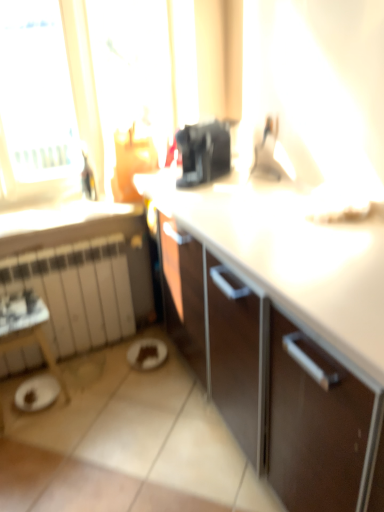
Question: Does brown matte plate at lower center turn towards white matte radiator at lower left?

Choices:
 (A) no
 (B) yes

Answer: (A)

Question: Does brown matte plate at lower center have a lesser width compared to white matte radiator at lower left?

Choices:
 (A) yes
 (B) no

Answer: (B)

Question: Is brown matte plate at lower center turned away from white matte radiator at lower left?

Choices:
 (A) no
 (B) yes

Answer: (B)

Question: Can you confirm if brown matte plate at lower center is bigger than white matte radiator at lower left?

Choices:
 (A) no
 (B) yes

Answer: (A)

Question: From a real-world perspective, is brown matte plate at lower center beneath white matte radiator at lower left?

Choices:
 (A) yes
 (B) no

Answer: (A)

Question: Is brown matte plate at lower center not within white matte radiator at lower left?

Choices:
 (A) no
 (B) yes

Answer: (B)

Question: From the image's perspective, is white matte radiator at lower left on top of brown matte plate at lower center?

Choices:
 (A) no
 (B) yes

Answer: (B)

Question: Considering the relative sizes of white matte radiator at lower left and brown matte plate at lower center in the image provided, is white matte radiator at lower left shorter than brown matte plate at lower center?

Choices:
 (A) yes
 (B) no

Answer: (B)

Question: Does white matte radiator at lower left have a greater height compared to brown matte plate at lower center?

Choices:
 (A) yes
 (B) no

Answer: (A)

Question: Is white matte radiator at lower left far away from brown matte plate at lower center?

Choices:
 (A) yes
 (B) no

Answer: (B)

Question: Could brown matte plate at lower center be considered to be inside white matte radiator at lower left?

Choices:
 (A) no
 (B) yes

Answer: (A)

Question: Are white matte radiator at lower left and brown matte plate at lower center beside each other?

Choices:
 (A) no
 (B) yes

Answer: (A)

Question: In terms of size, does brown matte plate at lower center appear bigger or smaller than white matte radiator at lower left?

Choices:
 (A) small
 (B) big

Answer: (A)